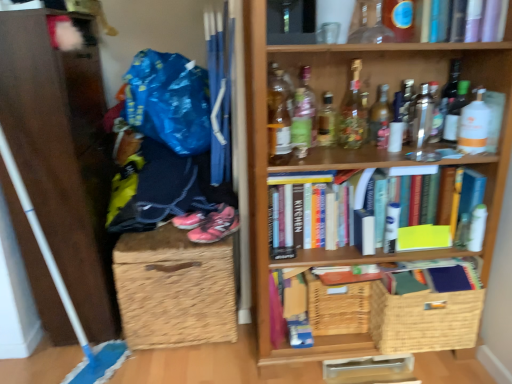
Find the location of a particular element. This screenshot has width=512, height=384. free spot above woven brown basket at lower right, the first basket from the right (from a real-world perspective) is located at coordinates (428, 272).